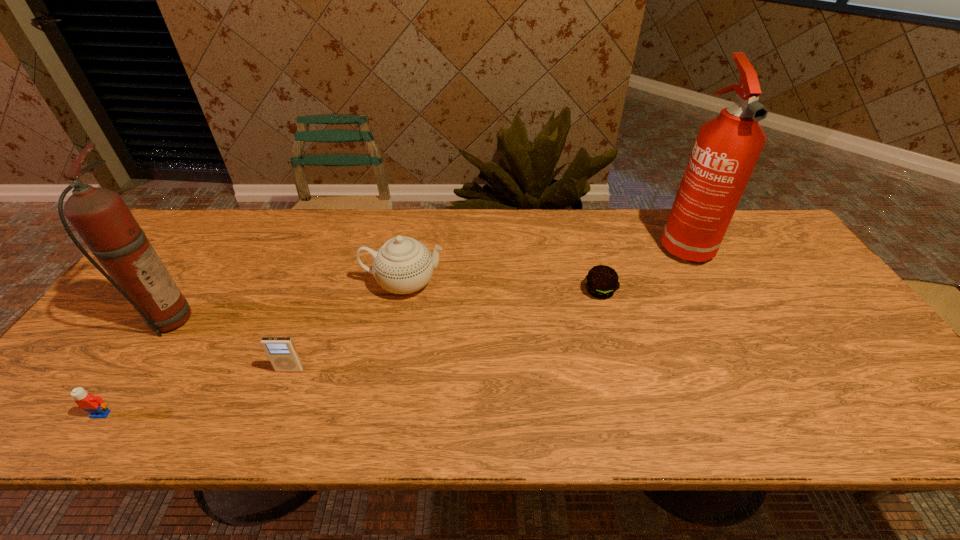
Where is `vacant space that satisfies the following two spatial constraints: 1. on the spout of the third tallest object; 2. on the face of the second shortest object`? vacant space that satisfies the following two spatial constraints: 1. on the spout of the third tallest object; 2. on the face of the second shortest object is located at coordinates (379, 414).

Find the location of a particular element. This screenshot has height=540, width=960. free space that satisfies the following two spatial constraints: 1. at the nozzle of the taller fire extinguisher; 2. on the spout of the chinaware is located at coordinates (705, 283).

This screenshot has width=960, height=540. Identify the location of vacant space that satisfies the following two spatial constraints: 1. on the spout of the chinaware; 2. on the face of the fifth tallest object. (379, 414).

Image resolution: width=960 pixels, height=540 pixels. Identify the location of free space that satisfies the following two spatial constraints: 1. on the spout of the third object from right to left; 2. on the left side of the fifth object from left to right. (402, 291).